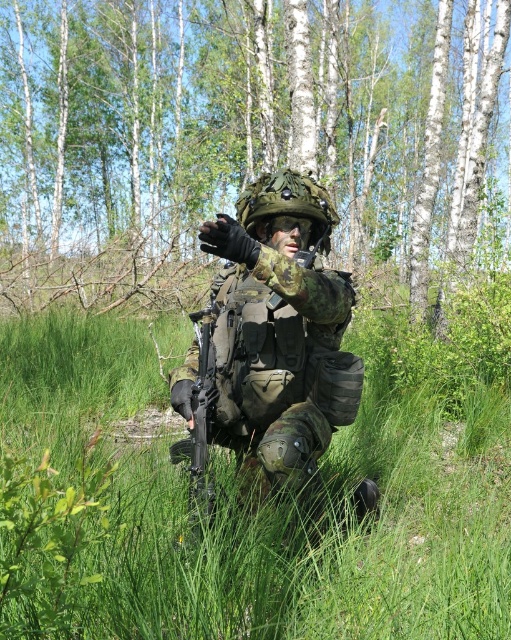
Between camouflage fabric uniform at center and matte black rifle at center, which one is positioned higher?

camouflage fabric uniform at center

Is point (294, 257) more distant than point (199, 324)?

No, (294, 257) is closer to viewer.

Where is `camouflage fabric uniform at center`? This screenshot has width=511, height=640. camouflage fabric uniform at center is located at coordinates (280, 328).

Where is `camouflage fabric uniform at center`? camouflage fabric uniform at center is located at coordinates (280, 328).

Is green matte grass at center to the left of camouflage fabric uniform at center from the viewer's perspective?

No, green matte grass at center is not to the left of camouflage fabric uniform at center.

Does point (487, 513) come farther from viewer compared to point (248, 440)?

Yes, it is behind point (248, 440).

Where is `green matte grass at center`? This screenshot has height=640, width=511. green matte grass at center is located at coordinates (320, 540).

Does green matte grass at center have a larger size compared to matte black rifle at center?

Yes, green matte grass at center is bigger than matte black rifle at center.

Does green matte grass at center appear under matte black rifle at center?

Yes.

This screenshot has height=640, width=511. Find the location of `green matte grass at center`. green matte grass at center is located at coordinates (320, 540).